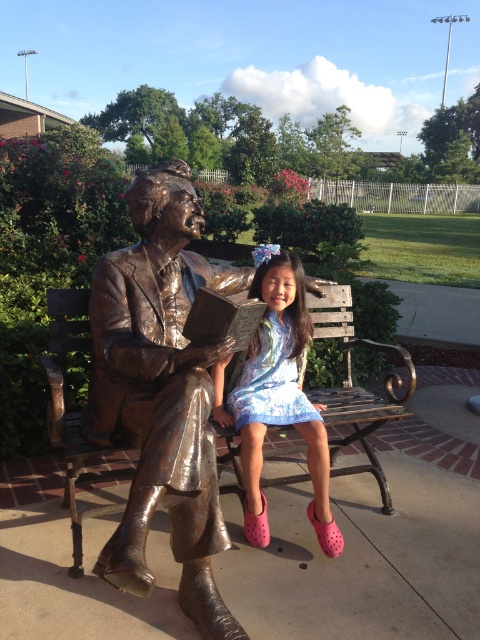
You are a photographer planning to take a photo of the wooden bench at center and the matte blue dress at center. Which object should you focus on first if you want to capture both in the frame without moving the camera?

The wooden bench at center is bigger than the matte blue dress at center, so you should focus on the wooden bench at center first to ensure it fills the frame appropriately before adjusting for the smaller matte blue dress at center.

You are standing in the park and see the statue and the girl sitting on the bench. If you want to walk from the statue to the girl, which direction should you move relative to the two points labeled as point (142, 520) and point (73, 419)?

To move from the statue to the girl, you should walk towards point (73, 419) because it is behind point (142, 520), which is in front of it. Since the statue is likely near the front point and the girl is at the back point, moving toward the latter would take you towards her.

In the scene shown: You are standing 2 meters away from the statue of the man reading a book. There is a point at coordinates point (176, 488) that you need to reach. Can you step forward to touch that point without moving past the statue?

The distance of point (176, 488) from viewer is 1.72 meters. Since you are currently 2 meters away from the statue, stepping forward to 1.72 meters would bring you closer, but you need to ensure you don not move past the statue. If the statue is positioned between you and the point, then moving forward 0.28 meters would allow you to reach the point without passing the statue.